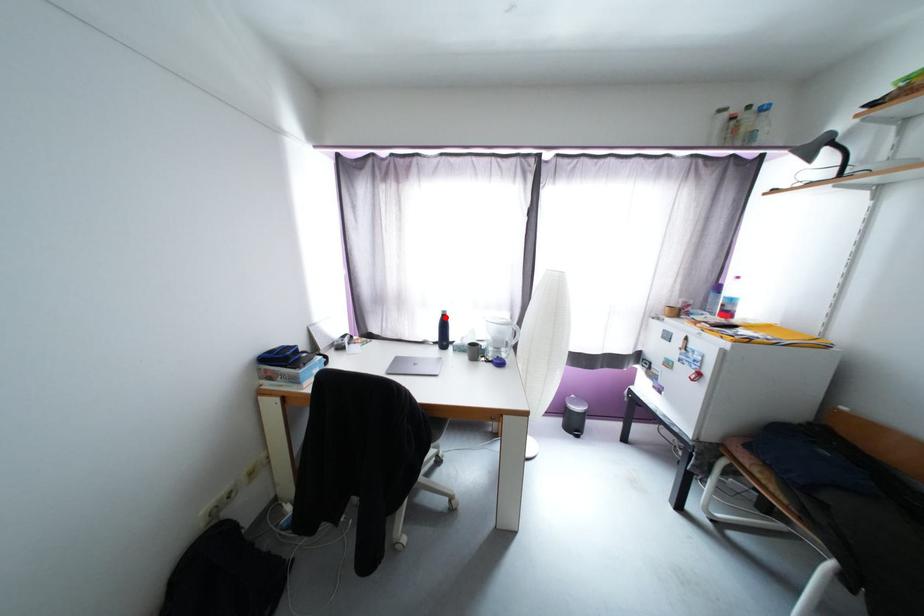
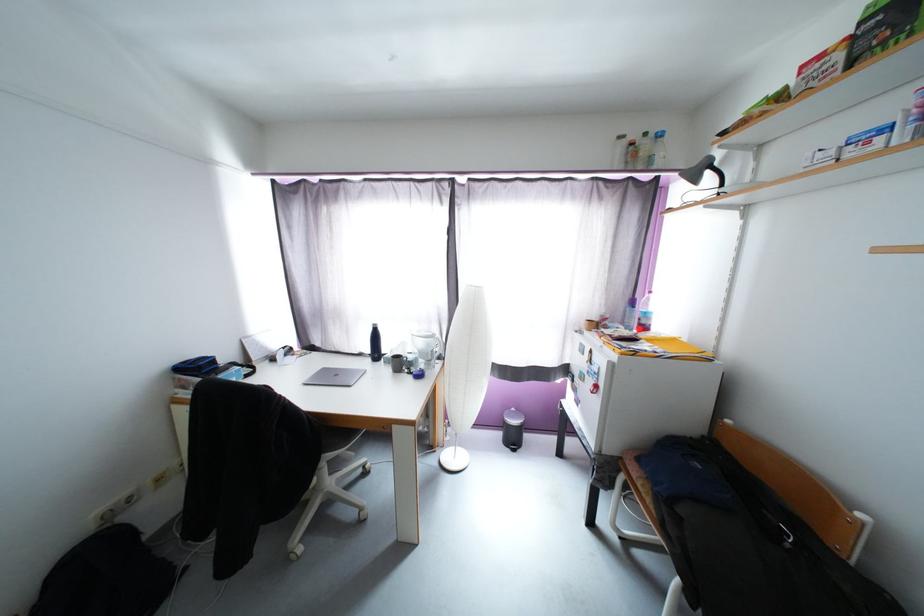
Find the pixel in the second image that matches the highlighted location in the first image.

(377, 331)